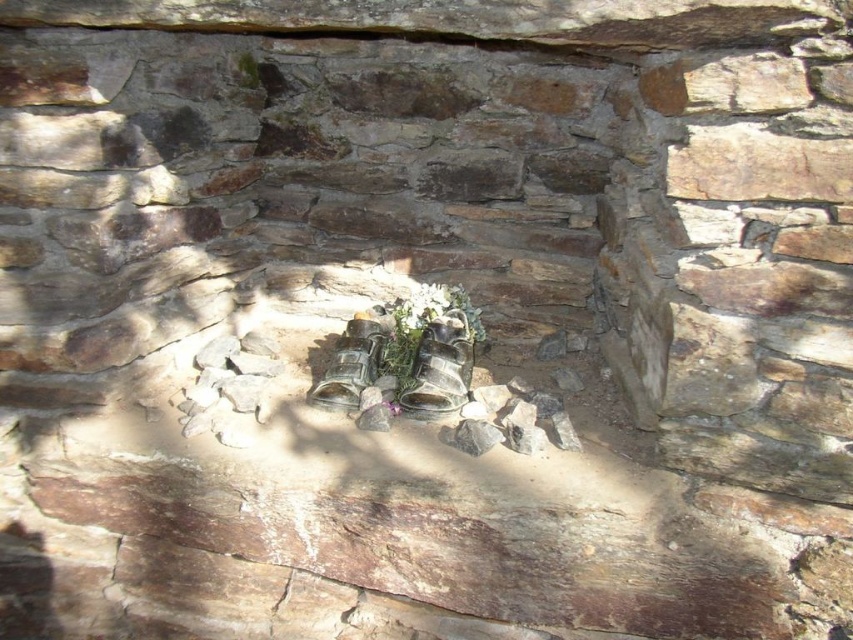
Is point (456, 388) positioned in front of point (421, 316)?

Yes, point (456, 388) is closer to viewer.

Is white matte floral arrangement at center to the right of white matte flowers at center from the viewer's perspective?

Indeed, white matte floral arrangement at center is positioned on the right side of white matte flowers at center.

Between point (445, 310) and point (448, 305), which one is positioned behind?

The point (448, 305) is more distant.

This screenshot has width=853, height=640. Find the location of `white matte floral arrangement at center`. white matte floral arrangement at center is located at coordinates (432, 344).

How distant is white matte flowers at center from white matte flower at center?

white matte flowers at center and white matte flower at center are 1.33 centimeters apart.

Between white matte flowers at center and white matte flower at center, which one has more height?

white matte flowers at center is taller.

Measure the distance between point (416, 304) and camera.

Point (416, 304) is 1.69 meters away from camera.

The width and height of the screenshot is (853, 640). In order to click on white matte flowers at center in this screenshot , I will do pos(434,308).

Does white matte floral arrangement at center have a lesser height compared to white matte flower at center?

In fact, white matte floral arrangement at center may be taller than white matte flower at center.

The height and width of the screenshot is (640, 853). Describe the element at coordinates (432, 344) in the screenshot. I see `white matte floral arrangement at center` at that location.

Identify the location of white matte floral arrangement at center. (432, 344).